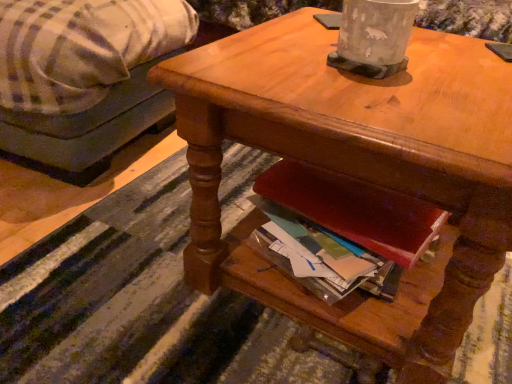
Locate an element on the screen. wooden desk at center is located at coordinates (356, 172).

The height and width of the screenshot is (384, 512). Describe the element at coordinates (356, 172) in the screenshot. I see `wooden desk at center` at that location.

The height and width of the screenshot is (384, 512). What are the coordinates of `plaid fabric couch at left` in the screenshot? It's located at (82, 59).

The width and height of the screenshot is (512, 384). What do you see at coordinates (82, 59) in the screenshot? I see `plaid fabric couch at left` at bounding box center [82, 59].

What is the approximate height of plaid fabric couch at left?

plaid fabric couch at left is 18.65 inches in height.

Where is `wooden desk at center`? wooden desk at center is located at coordinates (356, 172).

Visually, is plaid fabric couch at left positioned to the left or to the right of wooden desk at center?

Clearly, plaid fabric couch at left is on the left of wooden desk at center in the image.

Between plaid fabric couch at left and wooden desk at center, which one is positioned behind?

plaid fabric couch at left is further from the camera.

Does point (98, 108) appear closer or farther from the camera than point (197, 250)?

Point (98, 108) is positioned farther from the camera compared to point (197, 250).

From the image's perspective, between plaid fabric couch at left and wooden desk at center, who is located below?

wooden desk at center appears lower in the image.

From a real-world perspective, is plaid fabric couch at left above or below wooden desk at center?

From a real-world perspective, plaid fabric couch at left is physically below wooden desk at center.

From the picture: Is plaid fabric couch at left thinner than wooden desk at center?

Incorrect, the width of plaid fabric couch at left is not less than that of wooden desk at center.

Considering the sizes of objects plaid fabric couch at left and wooden desk at center in the image provided, who is shorter, plaid fabric couch at left or wooden desk at center?

wooden desk at center.

Does plaid fabric couch at left have a larger size compared to wooden desk at center?

Correct, plaid fabric couch at left is larger in size than wooden desk at center.

Choose the correct answer: Is plaid fabric couch at left inside wooden desk at center or outside it?

plaid fabric couch at left is not inside wooden desk at center, it's outside.

Is plaid fabric couch at left next to wooden desk at center and touching it?

No, plaid fabric couch at left is not next to wooden desk at center.

From the picture: Is plaid fabric couch at left oriented towards wooden desk at center?

No, plaid fabric couch at left is not turned towards wooden desk at center.

Find the location of a particular element. Image resolution: width=512 pixels, height=384 pixels. desk that is in front of the plaid fabric couch at left is located at coordinates (356, 172).

Visually, is wooden desk at center positioned to the left or to the right of plaid fabric couch at left?

Clearly, wooden desk at center is on the right of plaid fabric couch at left in the image.

In the image, is wooden desk at center positioned in front of or behind plaid fabric couch at left?

Visually, wooden desk at center is located in front of plaid fabric couch at left.

Considering the points (367, 92) and (132, 76), which point is in front, point (367, 92) or point (132, 76)?

Positioned in front is point (367, 92).

From the image's perspective, does wooden desk at center appear lower than plaid fabric couch at left?

Yes, from the image's perspective, wooden desk at center is beneath plaid fabric couch at left.

From a real-world perspective, is wooden desk at center on plaid fabric couch at left?

Yes.

Considering the relative sizes of wooden desk at center and plaid fabric couch at left in the image provided, is wooden desk at center thinner than plaid fabric couch at left?

Yes, wooden desk at center is thinner than plaid fabric couch at left.

Considering the sizes of objects wooden desk at center and plaid fabric couch at left in the image provided, who is taller, wooden desk at center or plaid fabric couch at left?

Standing taller between the two is plaid fabric couch at left.

Is wooden desk at center smaller than plaid fabric couch at left?

Correct, wooden desk at center occupies less space than plaid fabric couch at left.

Is wooden desk at center situated inside plaid fabric couch at left or outside?

wooden desk at center is outside plaid fabric couch at left.

Is there a large distance between wooden desk at center and plaid fabric couch at left?

Actually, wooden desk at center and plaid fabric couch at left are a little close together.

Is wooden desk at center aimed at plaid fabric couch at left?

No, wooden desk at center is not oriented towards plaid fabric couch at left.

In the scene shown: What's the angular difference between wooden desk at center and plaid fabric couch at left's facing directions?

The facing directions of wooden desk at center and plaid fabric couch at left are 9.7 degrees apart.

Image resolution: width=512 pixels, height=384 pixels. Identify the location of studio couch below the wooden desk at center (from a real-world perspective). (82, 59).

Image resolution: width=512 pixels, height=384 pixels. Identify the location of desk that appears below the plaid fabric couch at left (from the image's perspective). (356, 172).

Locate an element on the screen. Image resolution: width=512 pixels, height=384 pixels. studio couch below the wooden desk at center (from a real-world perspective) is located at coordinates (82, 59).